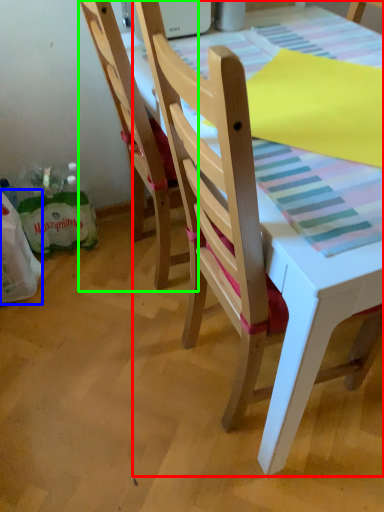
Question: Based on their relative distances, which object is nearer to chair (highlighted by a red box)? Choose from grocery bag (highlighted by a blue box) and chair (highlighted by a green box).

Choices:
 (A) grocery bag
 (B) chair

Answer: (B)